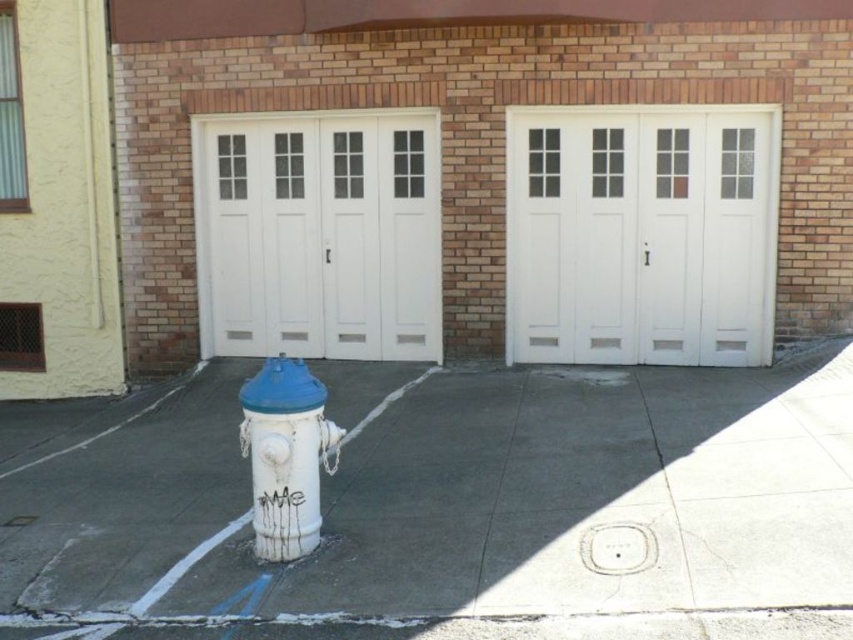
Between white concrete pavement at center and white painted wood garage door at center, which one appears on the right side from the viewer's perspective?

Positioned to the right is white painted wood garage door at center.

Between white concrete pavement at center and white painted wood garage door at center, which one has less height?

white concrete pavement at center

Is point (107, 452) farther from viewer compared to point (688, 125)?

That is False.

Where is `white concrete pavement at center`? white concrete pavement at center is located at coordinates (451, 508).

Does white painted wood garage door at center come in front of white matte hydrant at lower left?

No, it is not.

Which is above, white painted wood garage door at center or white matte hydrant at lower left?

white painted wood garage door at center is above.

Who is more forward, (746, 320) or (305, 445)?

Positioned in front is point (305, 445).

This screenshot has height=640, width=853. I want to click on white painted wood garage door at center, so coord(641,236).

Can you confirm if white concrete pavement at center is thinner than white painted wood at left?

Yes.

Locate an element on the screen. white concrete pavement at center is located at coordinates (451, 508).

This screenshot has height=640, width=853. I want to click on white concrete pavement at center, so click(451, 508).